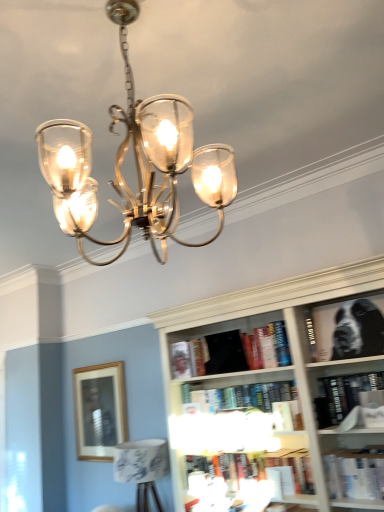
Identify the location of empty space that is ontop of hardcover book at lower center, which is the 7th book from top to bottom. This screenshot has width=384, height=512. (272, 448).